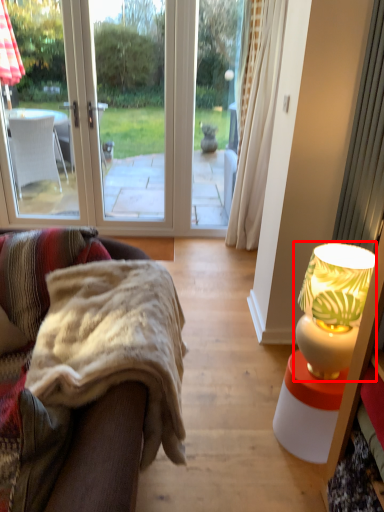
Question: In this image, where is lamp (annotated by the red box) located relative to studio couch?

Choices:
 (A) left
 (B) right

Answer: (B)